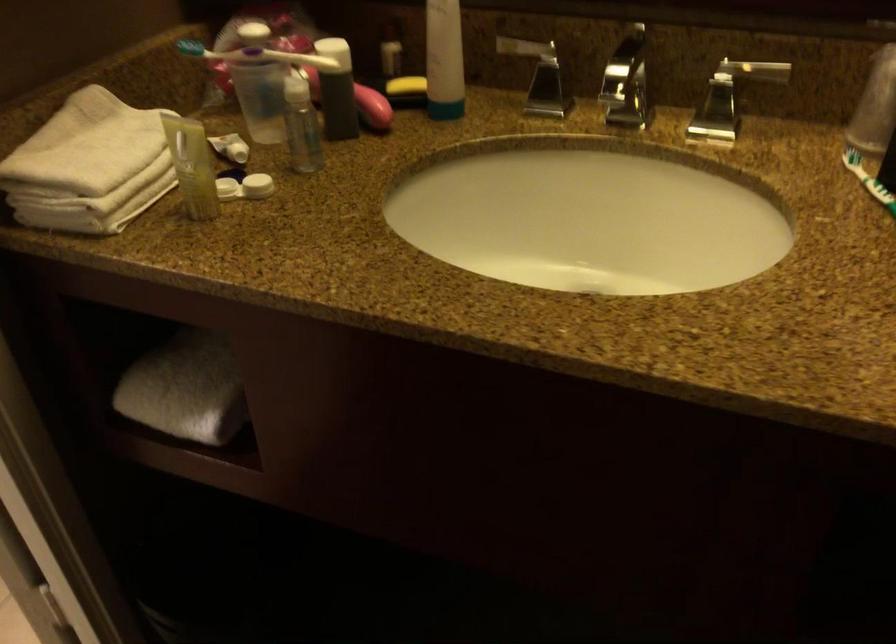
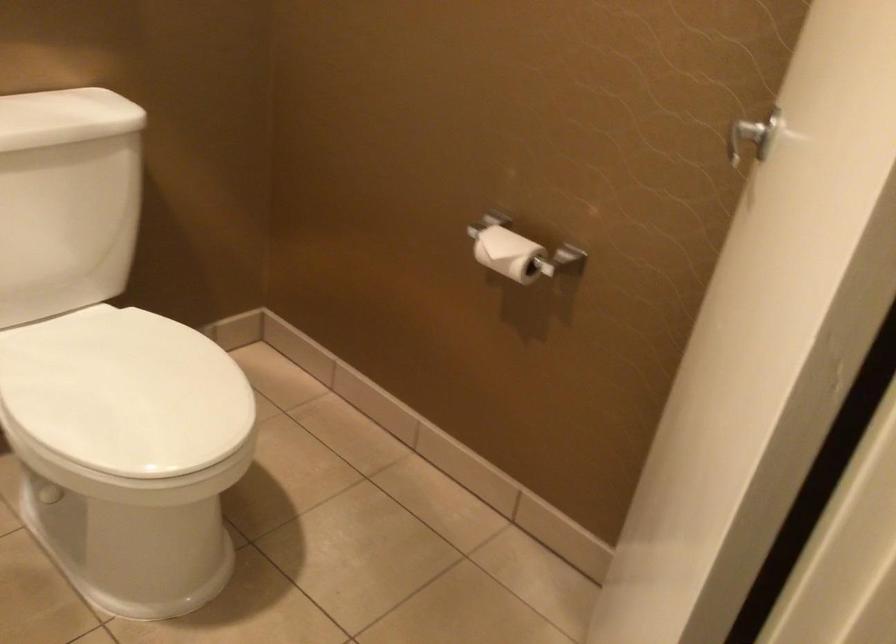
Question: The camera is either moving clockwise (left) or counter-clockwise (right) around the object. The first image is from the beginning of the video and the second image is from the end. Is the camera moving left or right when shooting the video?

Choices:
 (A) Left
 (B) Right

Answer: (B)